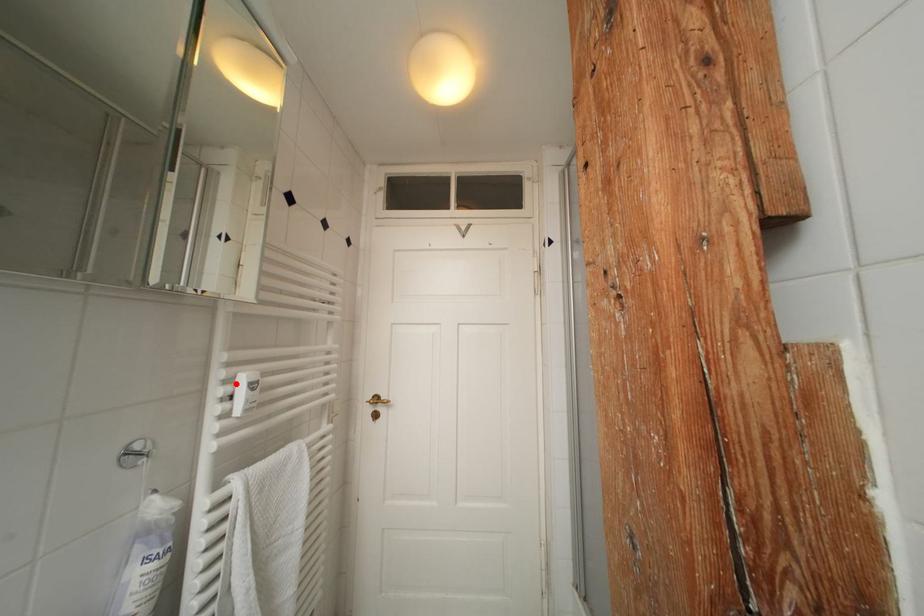
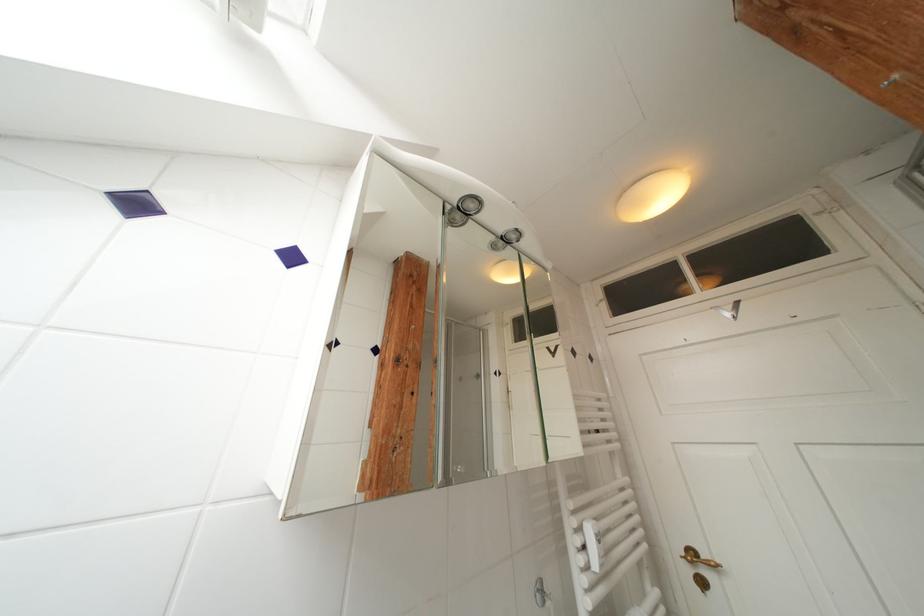
Find the pixel in the second image that matches the highlighted location in the first image.

(586, 533)